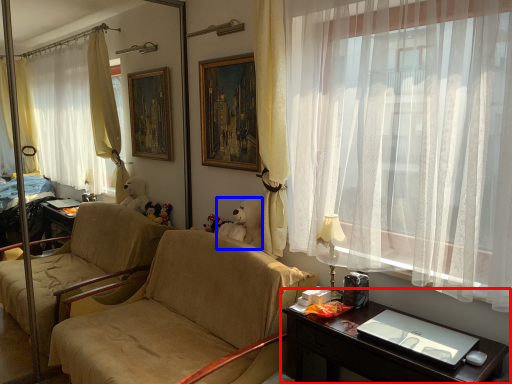
Question: Which of the following is the farthest to the observer, desk (highlighted by a red box) or teddy bear (highlighted by a blue box)?

Choices:
 (A) desk
 (B) teddy bear

Answer: (B)